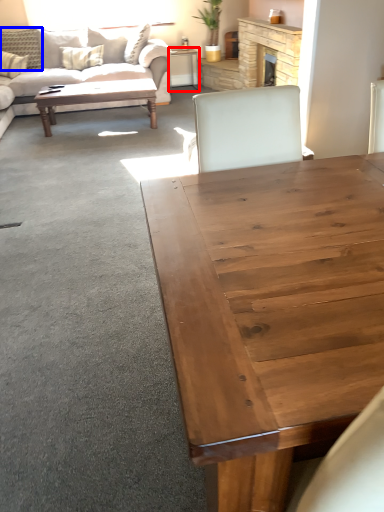
Question: Which object is further to the camera taking this photo, desk (highlighted by a red box) or pillow (highlighted by a blue box)?

Choices:
 (A) desk
 (B) pillow

Answer: (A)